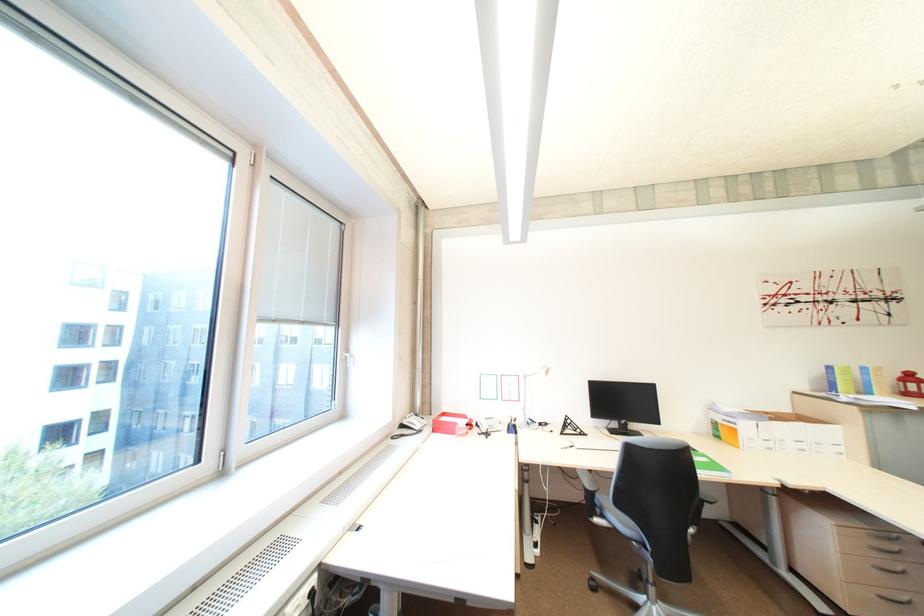
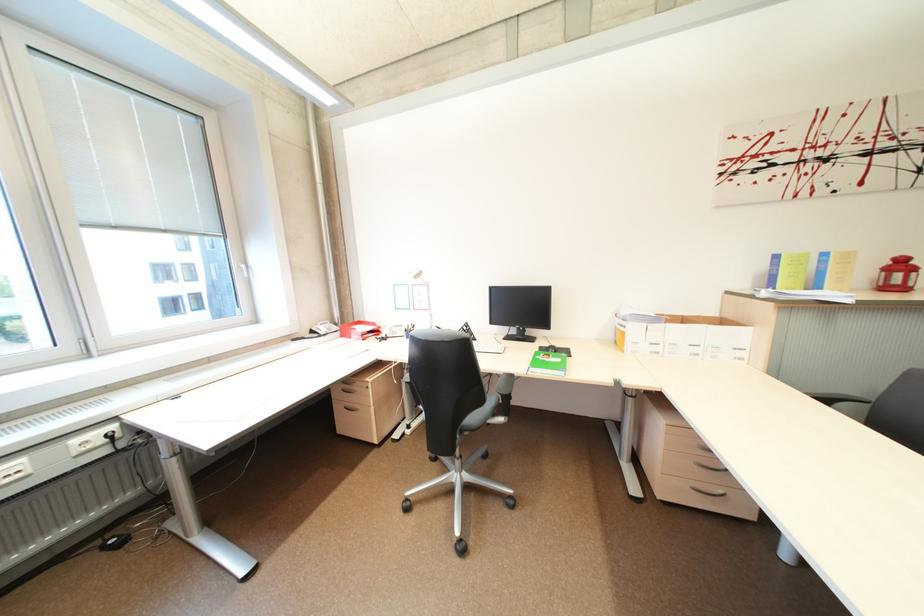
Locate, in the second image, the point that corresponds to [426,416] in the first image.

(345, 325)